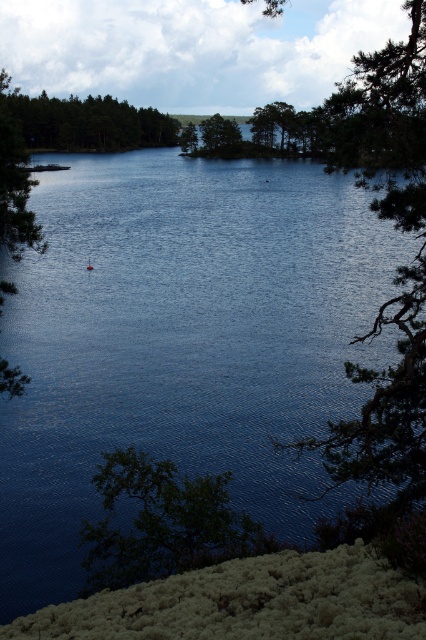
Describe the element at coordinates (85, 122) in the screenshot. I see `green matte tree at upper left` at that location.

Between green matte tree at upper left and green matte tree at center, which one is positioned lower?

green matte tree at center

I want to click on green matte tree at upper left, so (x=85, y=122).

Which of these two, green leafy tree at lower left or green matte tree at upper left, stands shorter?

Standing shorter between the two is green leafy tree at lower left.

Is point (121, 554) positioned after point (13, 99)?

No, it is not.

Locate an element on the screen. The height and width of the screenshot is (640, 426). green leafy tree at lower left is located at coordinates coord(163,522).

Who is higher up, green leafy tree at lower left or green matte tree at center?

green matte tree at center

Does green leafy tree at lower left have a lesser width compared to green matte tree at center?

Yes, green leafy tree at lower left is thinner than green matte tree at center.

Does point (103, 486) come closer to viewer compared to point (238, 134)?

Yes, point (103, 486) is closer to viewer.

Identify the location of green leafy tree at lower left. This screenshot has width=426, height=640. (163, 522).